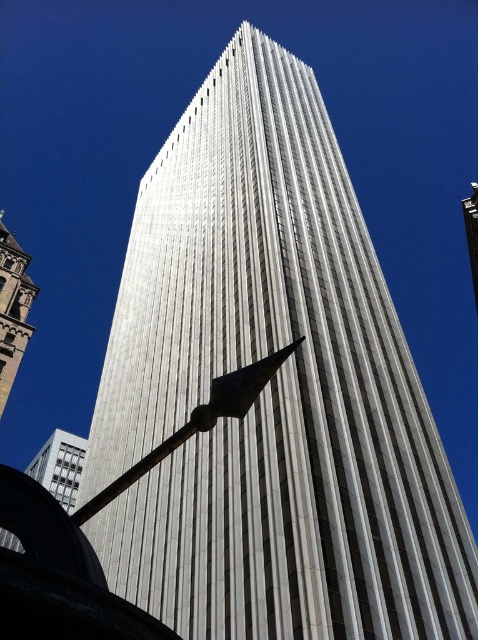
Does metallic polished pole at center have a greater height compared to white marble tower at left?

No.

The width and height of the screenshot is (478, 640). Describe the element at coordinates (198, 420) in the screenshot. I see `metallic polished pole at center` at that location.

Where is `metallic polished pole at center`? metallic polished pole at center is located at coordinates (198, 420).